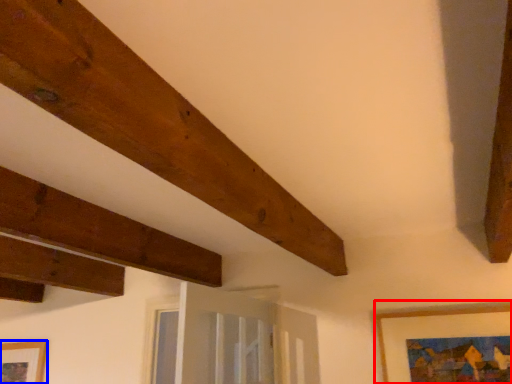
Question: Which object is further to the camera taking this photo, picture frame (highlighted by a red box) or picture frame (highlighted by a blue box)?

Choices:
 (A) picture frame
 (B) picture frame

Answer: (B)